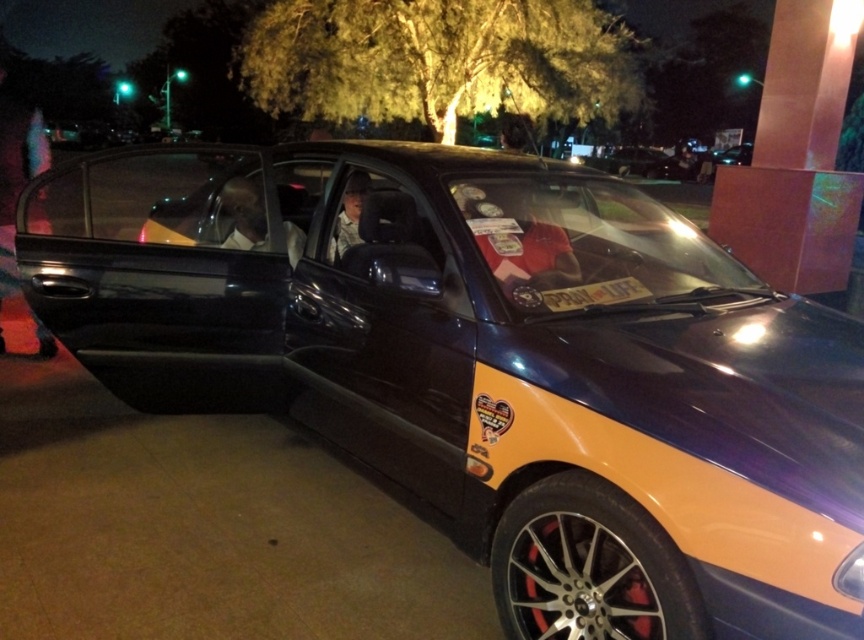
Who is positioned more to the left, matte black car door at left or matte black shirt at center?

Positioned to the left is matte black car door at left.

Describe the element at coordinates (16, 177) in the screenshot. I see `matte black car door at left` at that location.

Which is behind, point (2, 68) or point (234, 198)?

Positioned behind is point (2, 68).

Find the location of a particular element. matte black car door at left is located at coordinates (16, 177).

Is matte red shirt at center positioned before matte black car door at left?

Yes, it is in front of matte black car door at left.

Does matte red shirt at center appear under matte black car door at left?

Yes.

Find the location of a particular element. Image resolution: width=864 pixels, height=640 pixels. matte red shirt at center is located at coordinates (519, 240).

Is matte red shirt at center to the left of matte black shirt at center from the viewer's perspective?

In fact, matte red shirt at center is to the right of matte black shirt at center.

Can you confirm if matte red shirt at center is positioned above matte black shirt at center?

Actually, matte red shirt at center is below matte black shirt at center.

Is point (487, 198) behind point (226, 189)?

That is False.

Identify the location of matte red shirt at center. (519, 240).